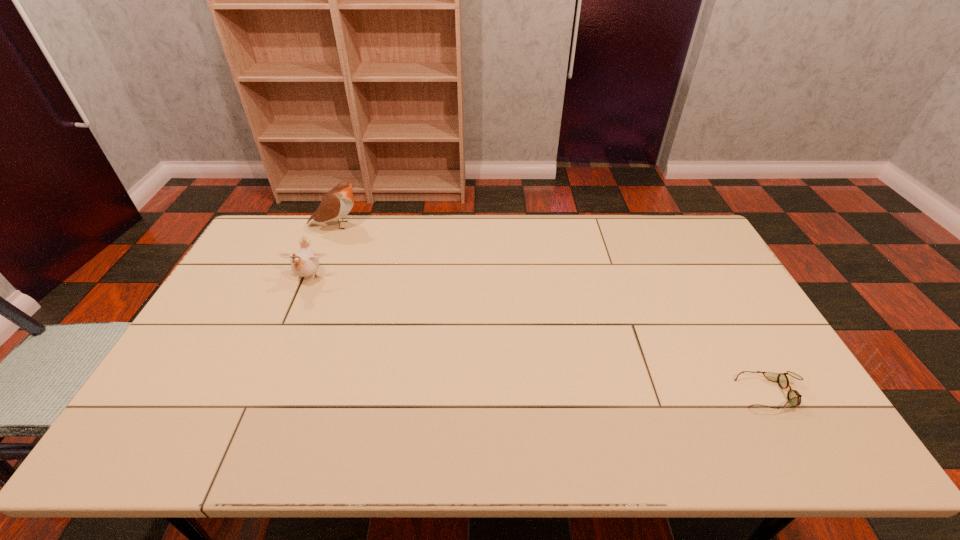
Locate an element on the screen. free space between the rightmost object and the farthest object is located at coordinates (554, 309).

Locate an element on the screen. This screenshot has height=540, width=960. free space between the second tallest object and the nearest object is located at coordinates (540, 336).

Locate an element on the screen. This screenshot has width=960, height=540. blank region between the farthest object and the second farthest object is located at coordinates (323, 252).

Locate an element on the screen. This screenshot has height=540, width=960. empty space that is in between the nearest object and the shorter bird is located at coordinates (540, 336).

You are a GUI agent. You are given a task and a screenshot of the screen. Output one action in this format:
    pyautogui.click(x=<x>, y=<y>)
    Task: Click on the free space between the spectacles and the taller bird
    
    Given the screenshot: What is the action you would take?
    pyautogui.click(x=554, y=309)

In order to click on vacant space that's between the spectacles and the nearer bird in this screenshot , I will do `click(540, 336)`.

The image size is (960, 540). What are the coordinates of `free spot between the shorter bird and the tallest object` in the screenshot? It's located at (323, 252).

Point out which object is positioned as the second nearest to the shorter bird. Please provide its 2D coordinates. Your answer should be formatted as a tuple, i.e. [(x, y)], where the tuple contains the x and y coordinates of a point satisfying the conditions above.

[(794, 398)]

Find the location of a particular element. object that is the closest to the farthest object is located at coordinates (305, 262).

Locate an element on the screen. vacant area that satisfies the following two spatial constraints: 1. at the face of the farther bird; 2. at the beak of the second nearest object is located at coordinates (314, 278).